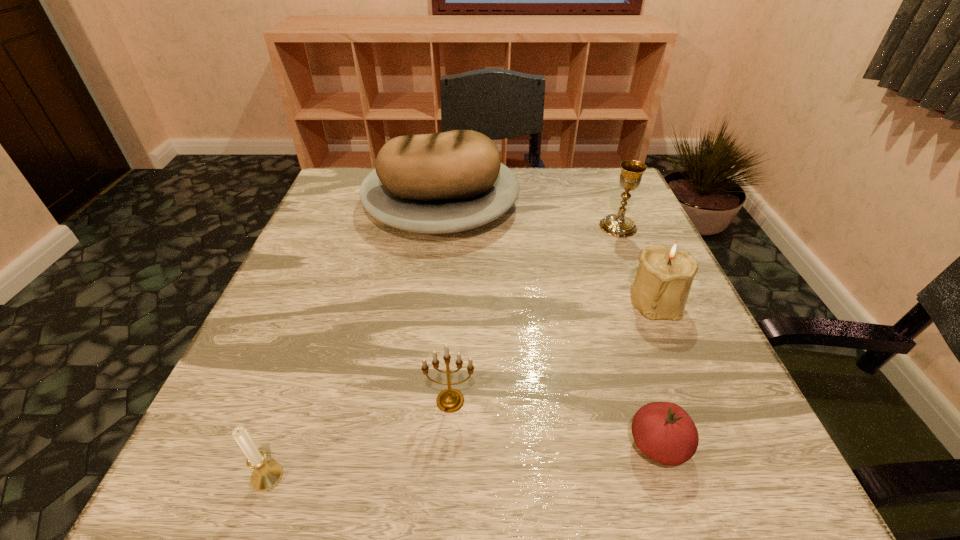
Find the location of `vacant space situated on the back of the farthest candle holder`. vacant space situated on the back of the farthest candle holder is located at coordinates (625, 228).

Identify the location of free space located 0.170m on the back of the third nearest object. This screenshot has height=540, width=960. (455, 312).

Find the location of a particular element. vacant space situated 0.330m on the right of the leftmost candle holder is located at coordinates (529, 477).

Find the location of a particular element. free location located on the right of the shortest object is located at coordinates (738, 445).

Image resolution: width=960 pixels, height=540 pixels. I want to click on object at the far edge, so click(x=454, y=181).

What are the coordinates of `candle holder at the near edge` in the screenshot? It's located at (267, 474).

Locate an element on the screen. tomato that is at the near edge is located at coordinates (663, 431).

Identify the location of bread present at the left edge. This screenshot has height=540, width=960. (454, 181).

Where is `candle holder positioned at the left edge`? candle holder positioned at the left edge is located at coordinates (267, 474).

The height and width of the screenshot is (540, 960). I want to click on chalice that is at the right edge, so click(x=618, y=225).